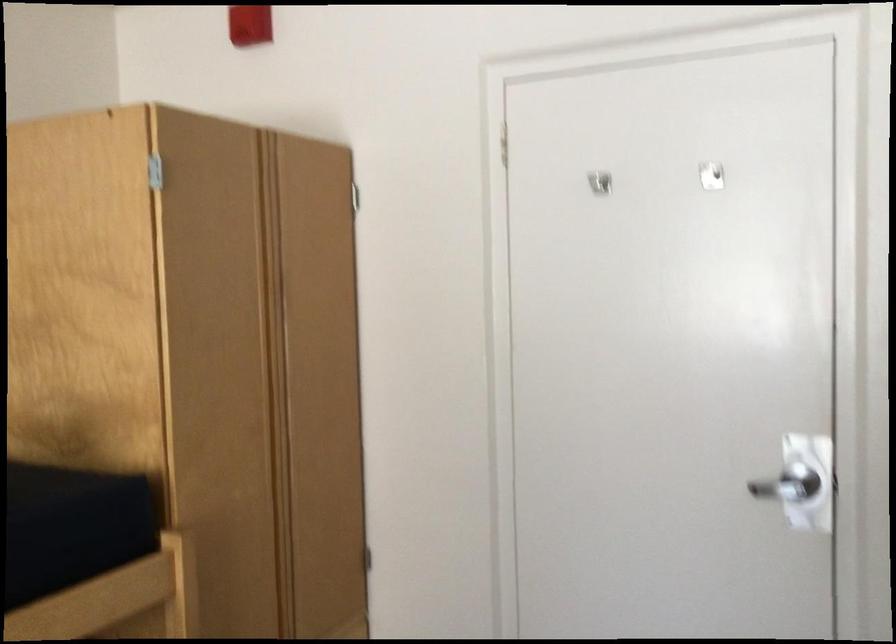
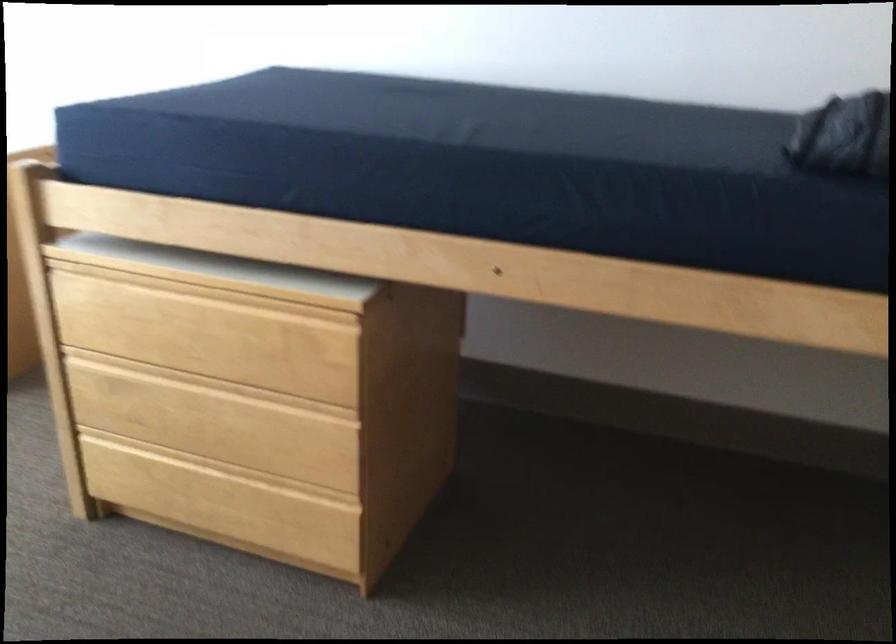
The images are taken continuously from a first-person perspective. In which direction is your viewpoint rotating?

The camera rotated toward left-down.